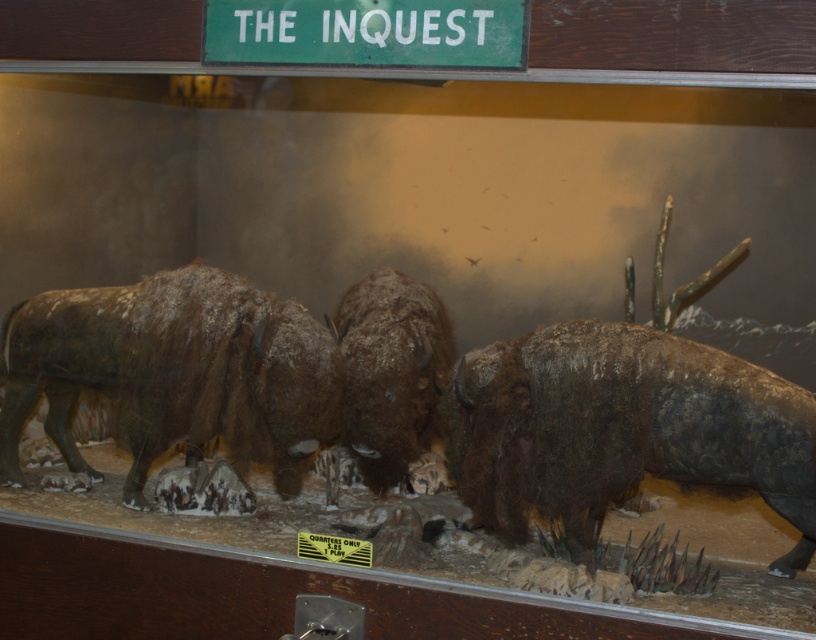
You are a zookeeper planning to feed the brown fuzzy yak at right and the brown fuzzy yak at center. Which yak should you approach first if you want to reach the one closer to the ground level?

The brown fuzzy yak at right is located below the brown fuzzy yak at center, so you should approach the brown fuzzy yak at right first since it is closer to ground level.

You are standing in front of a bison diorama and want to take a photo of the point at coordinates (613, 385). If your camera has a maximum focus range of 10 feet, will it be able to capture the point clearly?

The point at coordinates (613, 385) is 9.54 feet away from the camera, which is within the maximum focus range of 10 feet. Therefore, the camera can capture the point clearly.